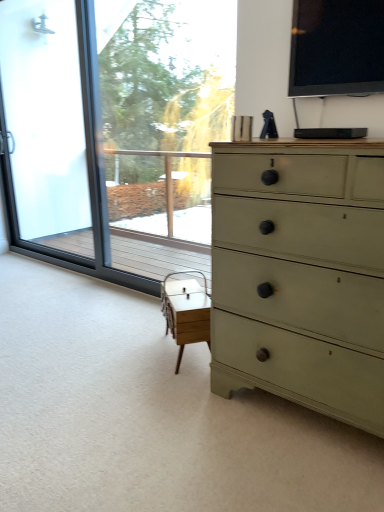
This screenshot has width=384, height=512. Find the location of `free space in front of matte green dresser at right`. free space in front of matte green dresser at right is located at coordinates (296, 474).